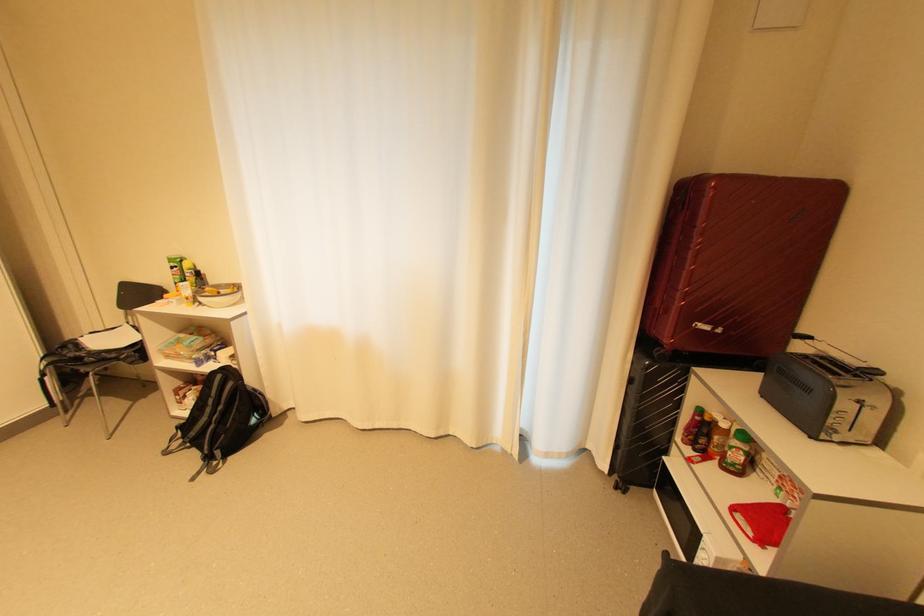
Find the location of a particular element. This screenshot has height=616, width=924. toaster lever is located at coordinates (833, 434).